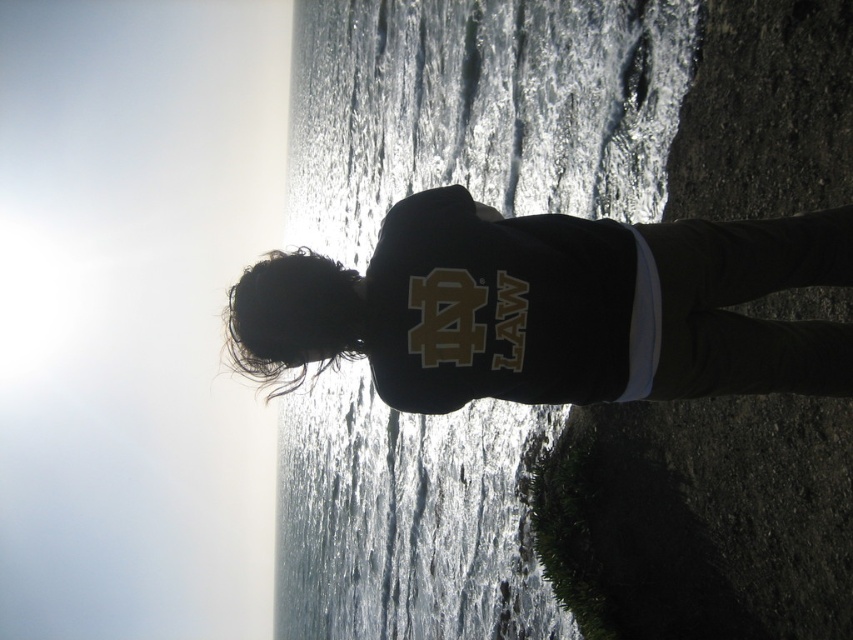
You are a photographer trying to capture the scene. The glistening water at center and the black matte shirt at center are both in your frame. Which object occupies more horizontal space in the photo?

The glistening water at center occupies more horizontal space in the photo because its width is larger than the black matte shirt at center.